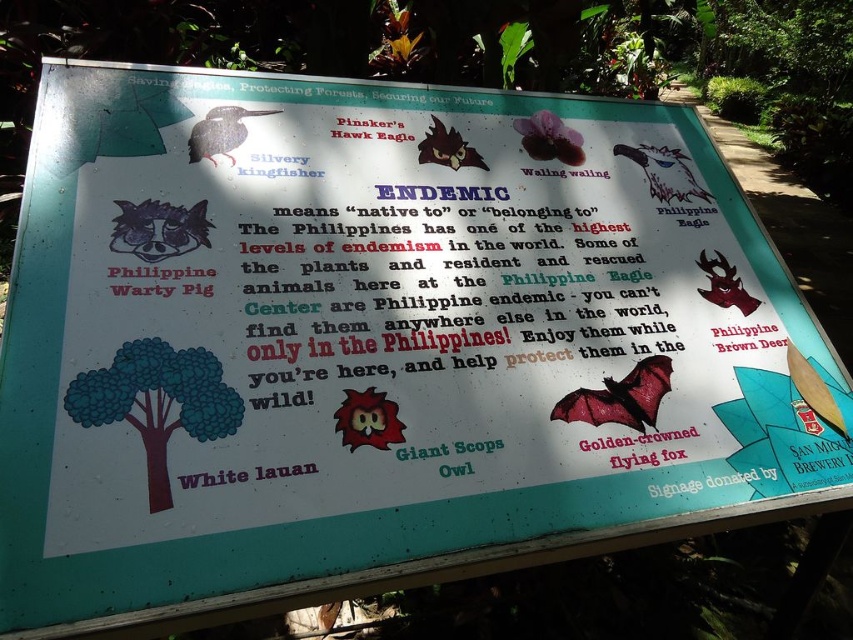
Is purple matte philippine warty pig at upper left shorter than purple matte flower at upper center?

Indeed, purple matte philippine warty pig at upper left has a lesser height compared to purple matte flower at upper center.

Can you confirm if purple matte philippine warty pig at upper left is positioned to the left of purple matte flower at upper center?

Indeed, purple matte philippine warty pig at upper left is positioned on the left side of purple matte flower at upper center.

What do you see at coordinates (158, 228) in the screenshot? I see `purple matte philippine warty pig at upper left` at bounding box center [158, 228].

The image size is (853, 640). Find the location of `purple matte philippine warty pig at upper left`. purple matte philippine warty pig at upper left is located at coordinates coord(158,228).

Locate an element on the screen. The image size is (853, 640). matte gray bird at upper left is located at coordinates (219, 131).

Which is more to the left, matte gray bird at upper left or matte brown deer at upper right?

From the viewer's perspective, matte gray bird at upper left appears more on the left side.

Between point (234, 122) and point (698, 289), which one is positioned in front?

Point (234, 122) is more forward.

Where is `matte gray bird at upper left`? This screenshot has width=853, height=640. matte gray bird at upper left is located at coordinates 219,131.

Looking at this image, does shiny red owl at center come in front of white glossy philippine eagle at upper right?

Yes, shiny red owl at center is closer to the viewer.

Does shiny red owl at center have a lesser height compared to white glossy philippine eagle at upper right?

Yes.

This screenshot has height=640, width=853. I want to click on shiny red owl at center, so click(368, 419).

Find the location of a particular element. The image size is (853, 640). shiny red owl at center is located at coordinates point(368,419).